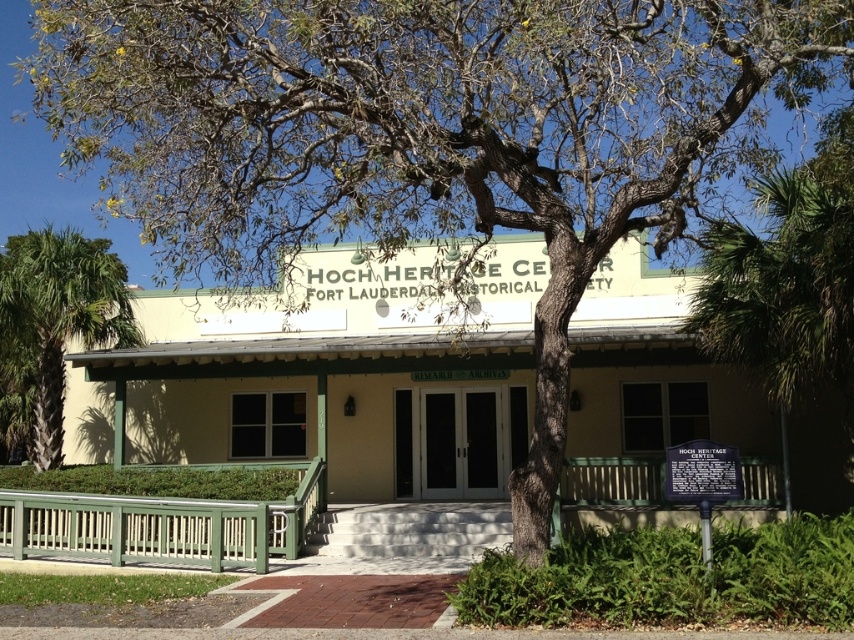
Question: Among these points, which one is nearest to the camera?

Choices:
 (A) (841, 323)
 (B) (69, 308)

Answer: (A)

Question: Which point is farther from the camera taking this photo?

Choices:
 (A) (816, 176)
 (B) (311, 499)
 (C) (667, 449)
 (D) (12, 388)

Answer: (D)

Question: Which of the following is the farthest from the observer?

Choices:
 (A) (401, 554)
 (B) (115, 292)

Answer: (B)

Question: Can you confirm if green leafy tree at right is wider than metallic plaque at center?

Choices:
 (A) no
 (B) yes

Answer: (B)

Question: Does green leafy tree at right appear on the right side of metallic plaque at center?

Choices:
 (A) no
 (B) yes

Answer: (B)

Question: Can you confirm if green leafy tree at right is bigger than green leafy palm tree at lower left?

Choices:
 (A) no
 (B) yes

Answer: (A)